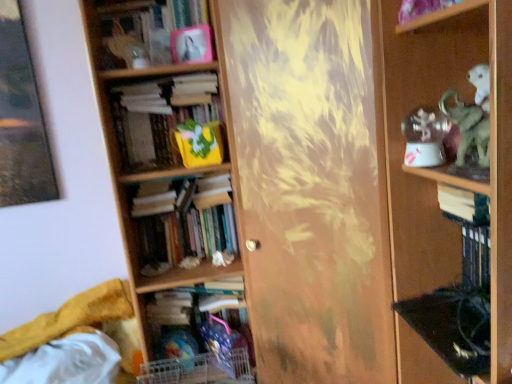
Question: Can we say matte pink photo frame at upper center, marked as the 1th book in a top-to-bottom arrangement, lies outside white paper book at right, placed as the 3th book when sorted from top to bottom?

Choices:
 (A) yes
 (B) no

Answer: (A)

Question: Is matte pink photo frame at upper center, marked as the 1th book in a top-to-bottom arrangement, oriented away from white paper book at right, placed as the 3th book when sorted from top to bottom?

Choices:
 (A) yes
 (B) no

Answer: (B)

Question: Considering the relative sizes of matte pink photo frame at upper center, marked as the 1th book in a top-to-bottom arrangement, and white paper book at right, placed as the 3th book when sorted from top to bottom, in the image provided, is matte pink photo frame at upper center, marked as the 1th book in a top-to-bottom arrangement, thinner than white paper book at right, placed as the 3th book when sorted from top to bottom,?

Choices:
 (A) yes
 (B) no

Answer: (B)

Question: From the image's perspective, is matte pink photo frame at upper center, marked as the 1th book in a top-to-bottom arrangement, above white paper book at right, marked as the third book in a bottom-to-top arrangement?

Choices:
 (A) no
 (B) yes

Answer: (B)

Question: Can you confirm if matte pink photo frame at upper center, which is the 5th book from bottom to top, is wider than white paper book at right, placed as the 3th book when sorted from top to bottom?

Choices:
 (A) no
 (B) yes

Answer: (B)

Question: In the image, is translucent plastic toy at lower center positioned in front of or behind yellow fabric bag at center-left, which appears as the second book when viewed from the top?

Choices:
 (A) front
 (B) behind

Answer: (B)

Question: Considering the positions of translucent plastic toy at lower center and yellow fabric bag at center-left, which ranks as the 4th book in bottom-to-top order, in the image, is translucent plastic toy at lower center taller or shorter than yellow fabric bag at center-left, which ranks as the 4th book in bottom-to-top order,?

Choices:
 (A) short
 (B) tall

Answer: (A)

Question: Does point (170, 337) appear closer or farther from the camera than point (207, 94)?

Choices:
 (A) closer
 (B) farther

Answer: (B)

Question: Is translucent plastic toy at lower center spatially inside yellow fabric bag at center-left, which appears as the second book when viewed from the top, or outside of it?

Choices:
 (A) outside
 (B) inside

Answer: (A)

Question: Does point (138, 218) appear closer or farther from the camera than point (212, 130)?

Choices:
 (A) farther
 (B) closer

Answer: (A)

Question: Is hardcover books at center, which appears as the 2th book when ordered from the bottom, bigger or smaller than yellow fabric bag at center-left, which appears as the second book when viewed from the top?

Choices:
 (A) big
 (B) small

Answer: (A)

Question: From the image's perspective, relative to yellow fabric bag at center-left, which appears as the second book when viewed from the top, is hardcover books at center, which appears as the 2th book when ordered from the bottom, above or below?

Choices:
 (A) below
 (B) above

Answer: (A)

Question: From a real-world perspective, is hardcover books at center, which appears as the 2th book when ordered from the bottom, physically located above or below yellow fabric bag at center-left, which ranks as the 4th book in bottom-to-top order?

Choices:
 (A) above
 (B) below

Answer: (B)

Question: Is matte pink photo frame at upper center, which is the 5th book from bottom to top, inside or outside of yellow fabric bag at center-left, which appears as the second book when viewed from the top?

Choices:
 (A) inside
 (B) outside

Answer: (B)

Question: Is matte pink photo frame at upper center, marked as the 1th book in a top-to-bottom arrangement, in front of or behind yellow fabric bag at center-left, which appears as the second book when viewed from the top, in the image?

Choices:
 (A) front
 (B) behind

Answer: (A)